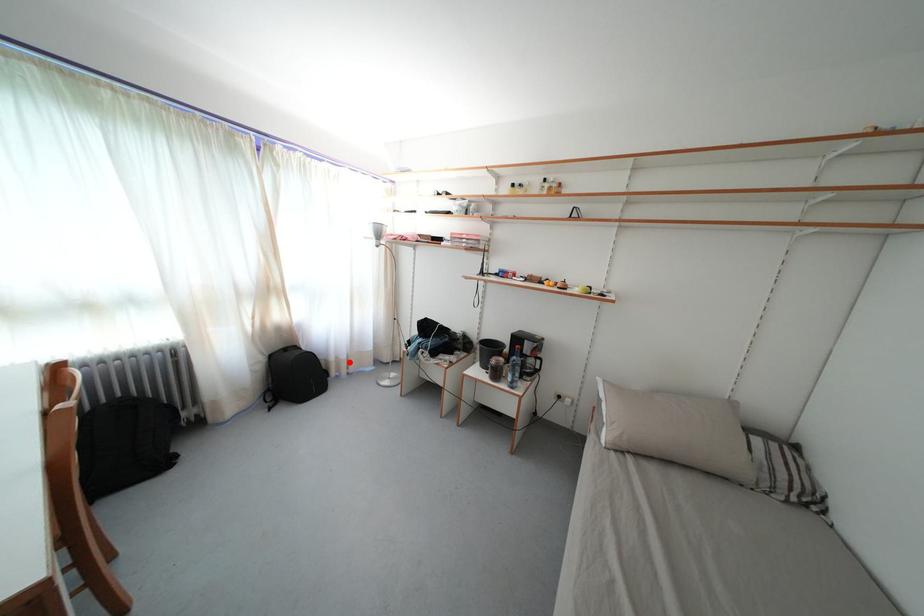
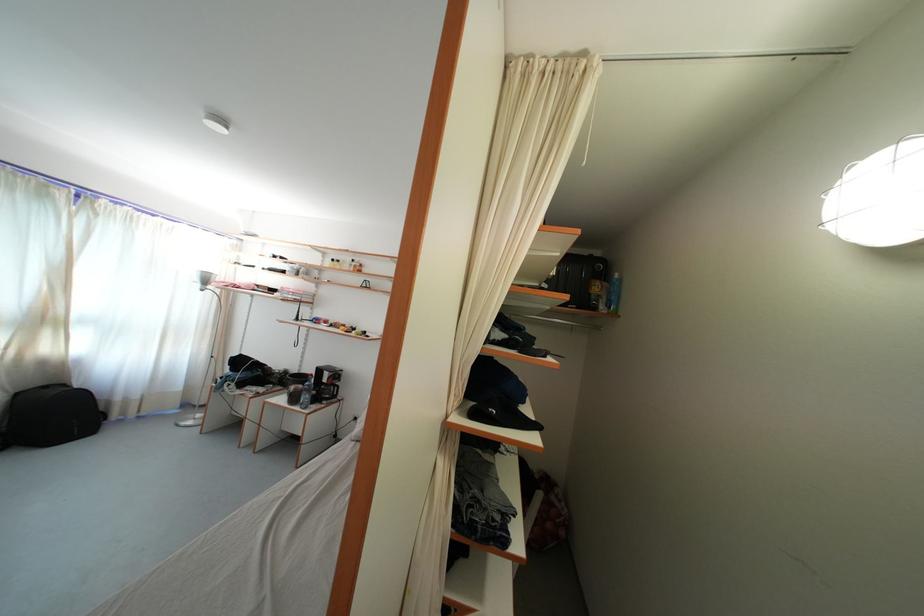
The point at the highlighted location is marked in the first image. Where is the corresponding point in the second image?

(141, 403)